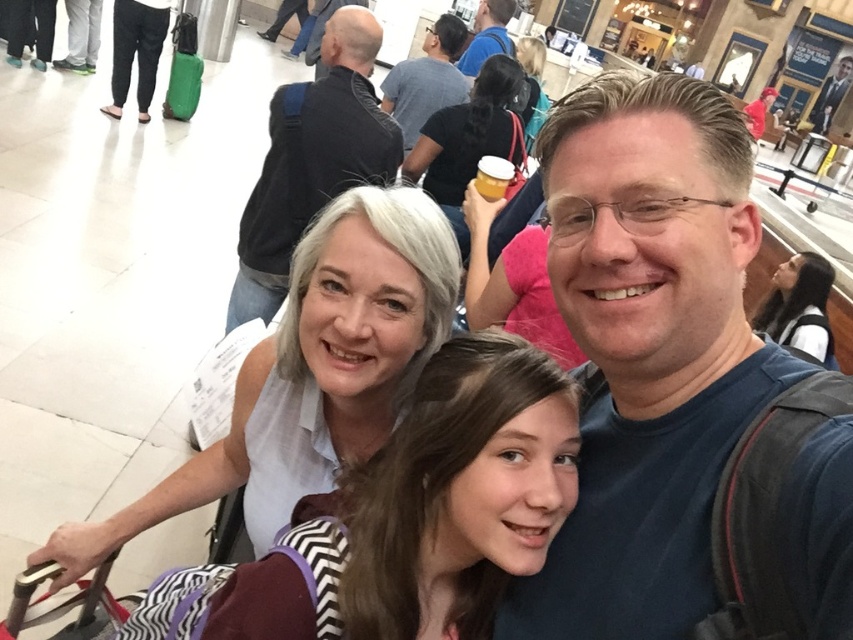
Where is the white matte shirt at center located in the image?

The white matte shirt at center is located at point [310,372] in the image.

You are a photographer trying to capture a clear shot of the light beige blouse at center and the dark brown hair at upper right. Which object should you focus on first if you want to ensure both are in focus?

The light beige blouse at center should be focused on first because it is smaller in size compared to the dark brown hair at upper right, allowing for better depth of field adjustment.